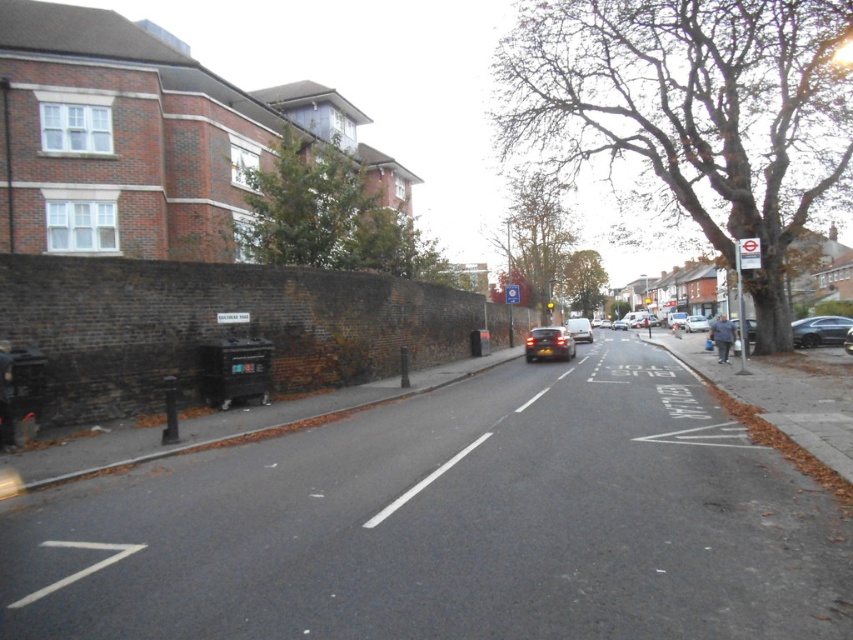
Describe the element at coordinates (820, 330) in the screenshot. I see `shiny black car at right` at that location.

Who is taller, shiny black car at right or metallic silver bus stop sign at right?

With more height is metallic silver bus stop sign at right.

Is point (830, 339) closer to camera compared to point (738, 310)?

No, (830, 339) is further to viewer.

Find the location of `shiny black car at right`. shiny black car at right is located at coordinates (820, 330).

Who is lower down, metallic silver bus stop sign at right or shiny black car at center?

shiny black car at center

Which is above, metallic silver bus stop sign at right or shiny black car at center?

metallic silver bus stop sign at right is higher up.

Between point (747, 264) and point (846, 346), which one is positioned behind?

Positioned behind is point (846, 346).

The width and height of the screenshot is (853, 640). What are the coordinates of `metallic silver bus stop sign at right` in the screenshot? It's located at (741, 285).

Does shiny silver car at center have a lesser height compared to silver metallic van at center?

Yes, shiny silver car at center is shorter than silver metallic van at center.

Does shiny silver car at center appear on the right side of silver metallic van at center?

In fact, shiny silver car at center is to the left of silver metallic van at center.

Where is `shiny silver car at center`? This screenshot has height=640, width=853. shiny silver car at center is located at coordinates (548, 344).